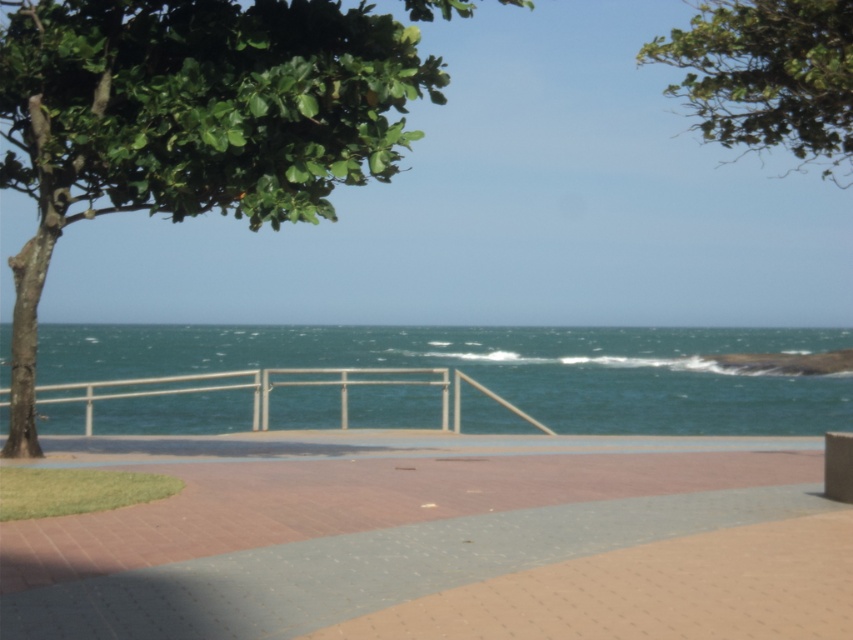
You are standing on the walkway and want to take a photo of the ocean. To avoid blocking the view with the green leafy tree at upper left and the white metal rail at center, which object should you move to the right side of?

To avoid blocking the ocean view, you should move the green leafy tree at upper left to the right side of the white metal rail at center. Since the green leafy tree at upper left is currently to the left of the white metal rail at center, shifting it to the right would place it beside the rail, keeping it out of the main view.

You are standing on the walkway and see both the green leafy tree at upper left and the green leafy tree at upper center. Which tree has a thicker trunk?

The green leafy tree at upper center has a thicker trunk than the green leafy tree at upper left.